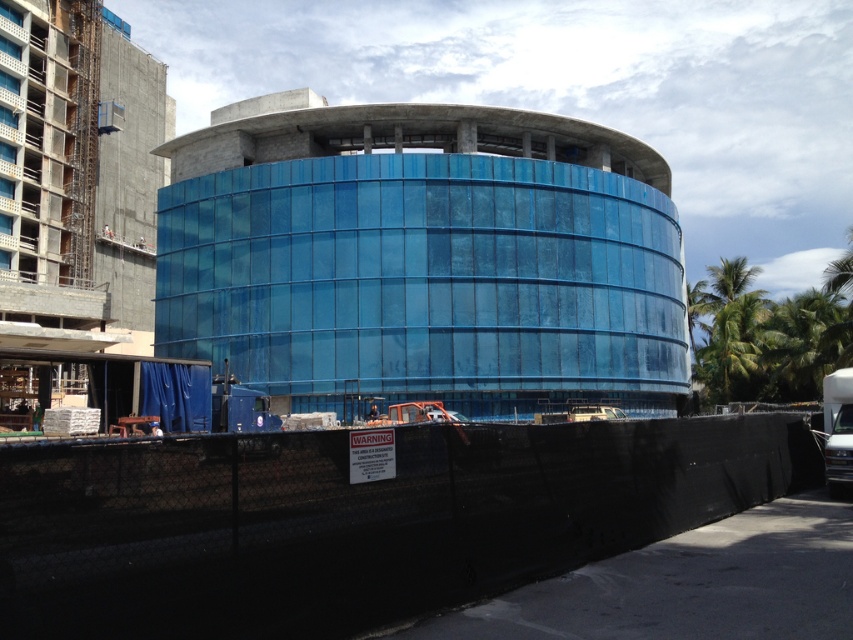
Does green leafy palm tree at right appear under red shirt construction worker at center?

Actually, green leafy palm tree at right is above red shirt construction worker at center.

Is green leafy palm tree at right thinner than red shirt construction worker at center?

In fact, green leafy palm tree at right might be wider than red shirt construction worker at center.

Is point (743, 330) farther from camera compared to point (107, 234)?

No.

Image resolution: width=853 pixels, height=640 pixels. In order to click on green leafy palm tree at right in this screenshot , I will do `click(727, 323)`.

Does transparent glass building at center appear on the right side of black mesh fence at lower center?

No, transparent glass building at center is not to the right of black mesh fence at lower center.

Who is shorter, transparent glass building at center or black mesh fence at lower center?

black mesh fence at lower center is shorter.

Is point (173, 212) less distant than point (509, 561)?

That is False.

Where is `transparent glass building at center`? The width and height of the screenshot is (853, 640). transparent glass building at center is located at coordinates (422, 257).

In the scene shown: Who is more forward, [196,140] or [112,237]?

Point [196,140]

Could you measure the distance between transparent glass building at center and red shirt construction worker at center?

transparent glass building at center is 144.68 feet from red shirt construction worker at center.

Between point (520, 340) and point (109, 228), which one is positioned in front?

Positioned in front is point (520, 340).

Image resolution: width=853 pixels, height=640 pixels. I want to click on transparent glass building at center, so click(x=422, y=257).